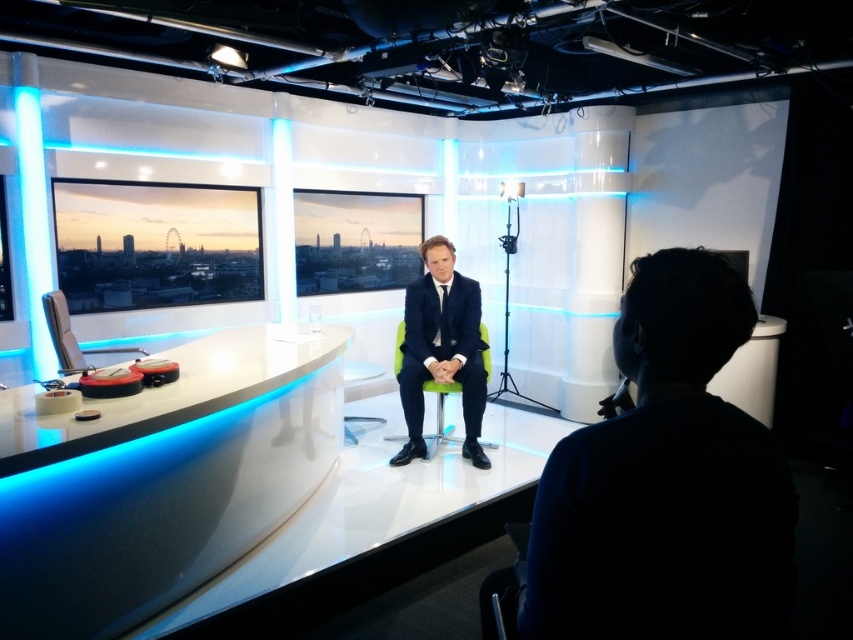
You are a guest speaker preparing to join a live broadcast in this studio. You need to move from the green fabric chair at center to the dark blue fabric at center to adjust your microphone. Given that your wheelchair has a turning radius of 10 feet, will you have enough space to maneuver between these two objects?

The distance between the dark blue fabric at center and the green fabric chair at center is 9.64 feet. Since your wheelchair has a turning radius of 10 feet, you have sufficient space to maneuver between these two objects as the required space is slightly less than the wheelchair requires.

Consider the image. You are a costume designer preparing for a live broadcast. You need to place a navy blue suit at center and a matte black chair at left in the studio. Based on their sizes, which object will require more floor space?

The navy blue suit at center requires more floor space because its width is larger than the matte black chair at left.

You are a guest on a TV show and need to sit down. You see the dark blue fabric at center and the green fabric chair at center. Which one should you sit on?

You should sit on the green fabric chair at center because it is a chair, while the dark blue fabric at center is likely just a decorative or functional fabric element and not meant for sitting.